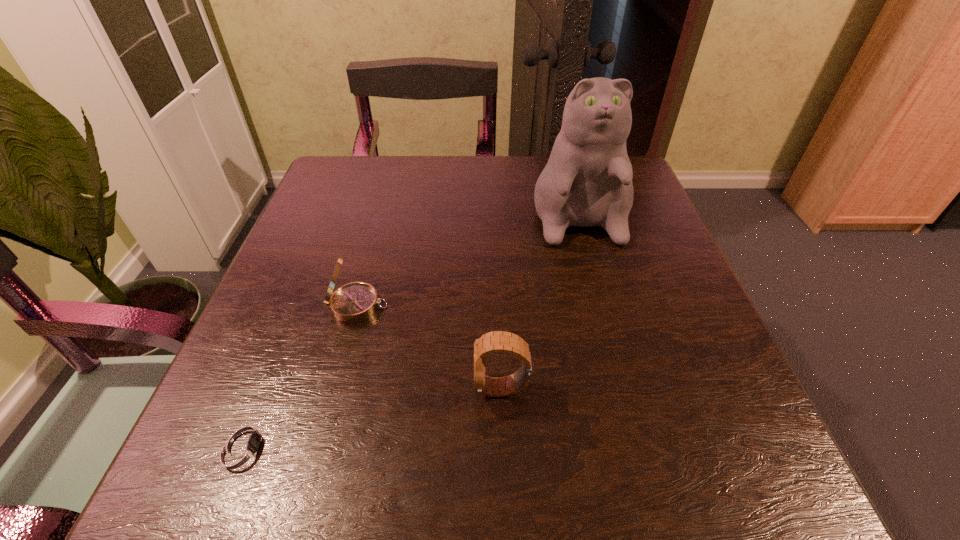
Locate an element on the screen. Image resolution: width=960 pixels, height=540 pixels. object at the far right corner is located at coordinates (587, 181).

In the image, there is a desktop. Where is `vacant area at the far edge`? This screenshot has width=960, height=540. vacant area at the far edge is located at coordinates (523, 190).

This screenshot has width=960, height=540. I want to click on vacant region at the near edge, so click(x=393, y=458).

The width and height of the screenshot is (960, 540). Find the location of `vacant space at the left edge`. vacant space at the left edge is located at coordinates (303, 328).

Image resolution: width=960 pixels, height=540 pixels. In order to click on free space at the right edge of the desktop in this screenshot , I will do `click(654, 238)`.

Image resolution: width=960 pixels, height=540 pixels. I want to click on vacant area at the far left corner of the desktop, so click(347, 173).

The image size is (960, 540). I want to click on vacant area that lies between the compass and the second nearest object, so click(430, 347).

Where is `free point between the second object from right to left and the nearer watch`? The width and height of the screenshot is (960, 540). free point between the second object from right to left and the nearer watch is located at coordinates (372, 417).

At what (x,y) coordinates should I click in order to perform the action: click on vacant space in between the third object from left to right and the leftmost object. Please return your answer as a coordinate pair (x, y). This screenshot has width=960, height=540. Looking at the image, I should click on (372, 417).

Where is `vacant area between the second nearest object and the compass`? vacant area between the second nearest object and the compass is located at coordinates (430, 347).